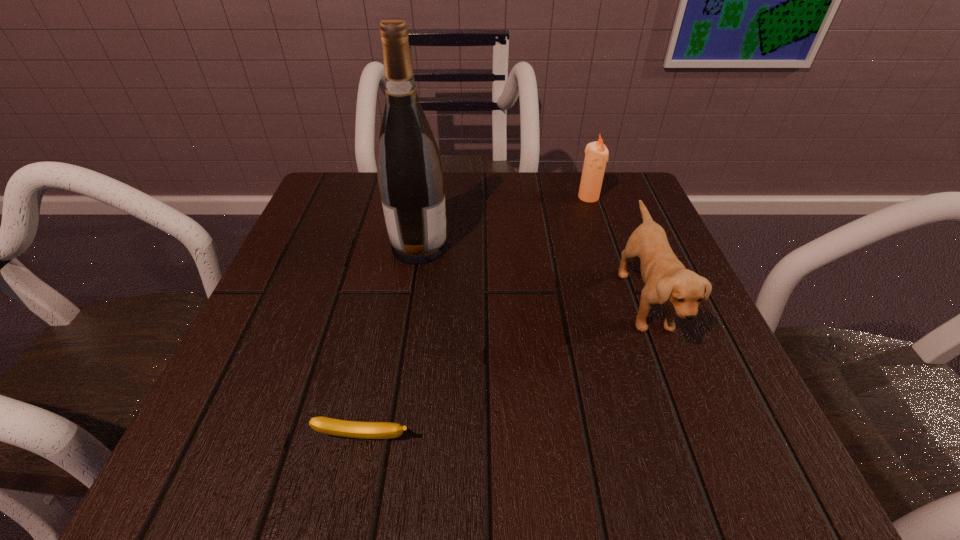
Locate an element on the screen. Image resolution: width=960 pixels, height=540 pixels. vacant area that lies between the banana and the farthest object is located at coordinates (476, 318).

The height and width of the screenshot is (540, 960). Identify the location of unoccupied area between the farthest object and the tallest object. (504, 222).

Find the location of `vacant area that lies between the tallest object and the shortest object`. vacant area that lies between the tallest object and the shortest object is located at coordinates 392,342.

Where is `object that stands as the second closest to the candle`? The height and width of the screenshot is (540, 960). object that stands as the second closest to the candle is located at coordinates (410, 174).

Identify which object is the third nearest to the tallest object. Please provide its 2D coordinates. Your answer should be formatted as a tuple, i.e. [(x, y)], where the tuple contains the x and y coordinates of a point satisfying the conditions above.

[(353, 429)]